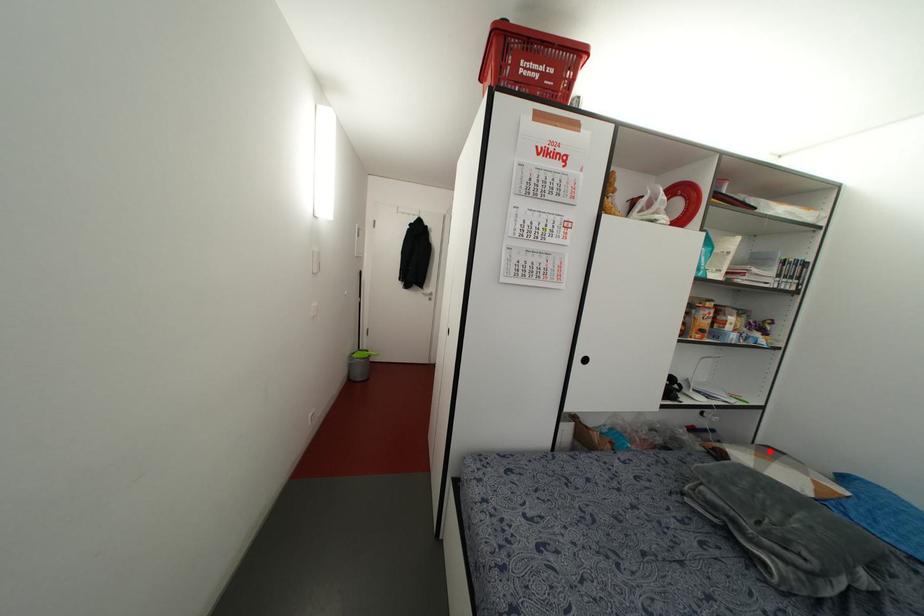
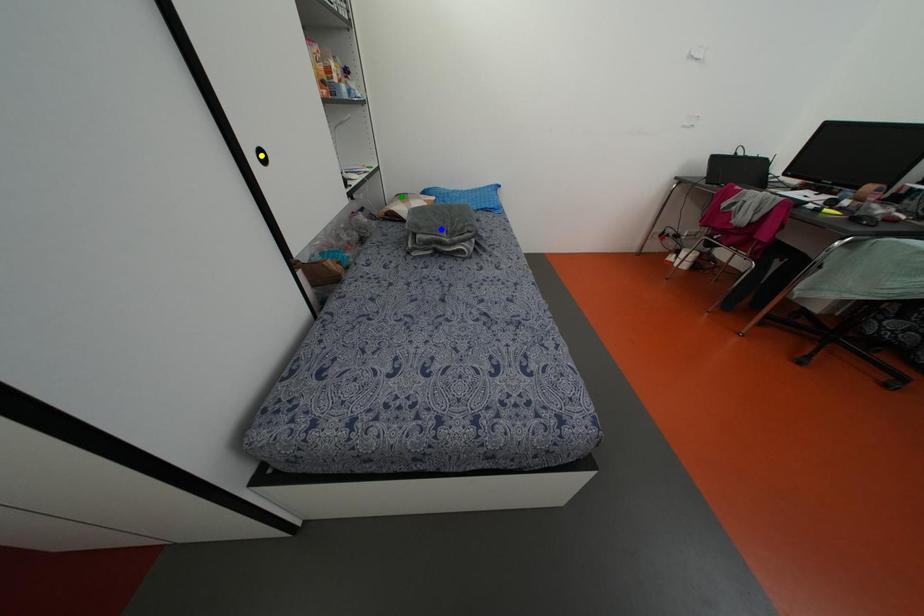
Question: I am providing you with two images of the same scene from different viewpoints. A red point is marked on the first image. You are given multiple points on the second image. Which spot in image 2 lines up with the point in image 1?

Choices:
 (A) blue point
 (B) yellow point
 (C) green point

Answer: (C)